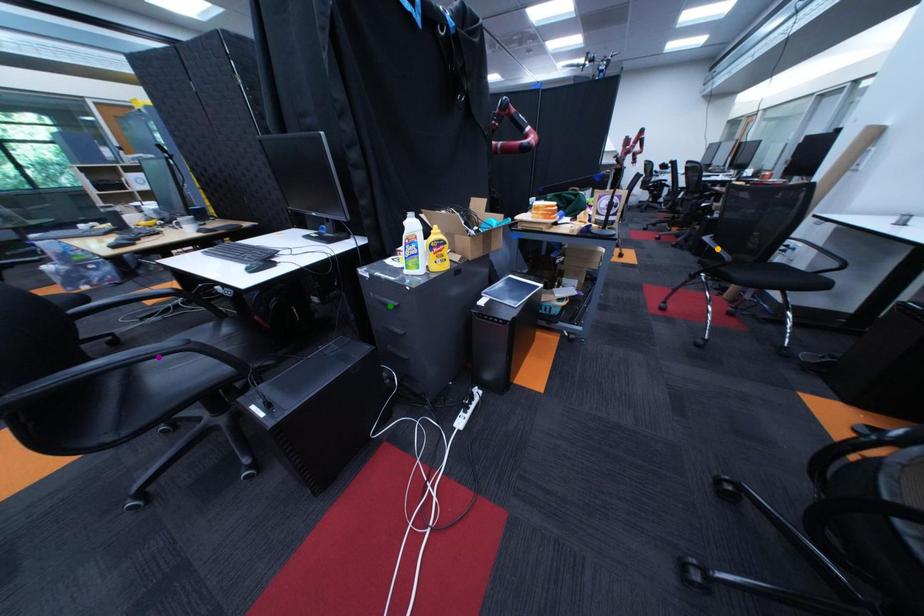
Order these from nearest to farthest:
1. orange point
2. green point
3. purple point

purple point < green point < orange point